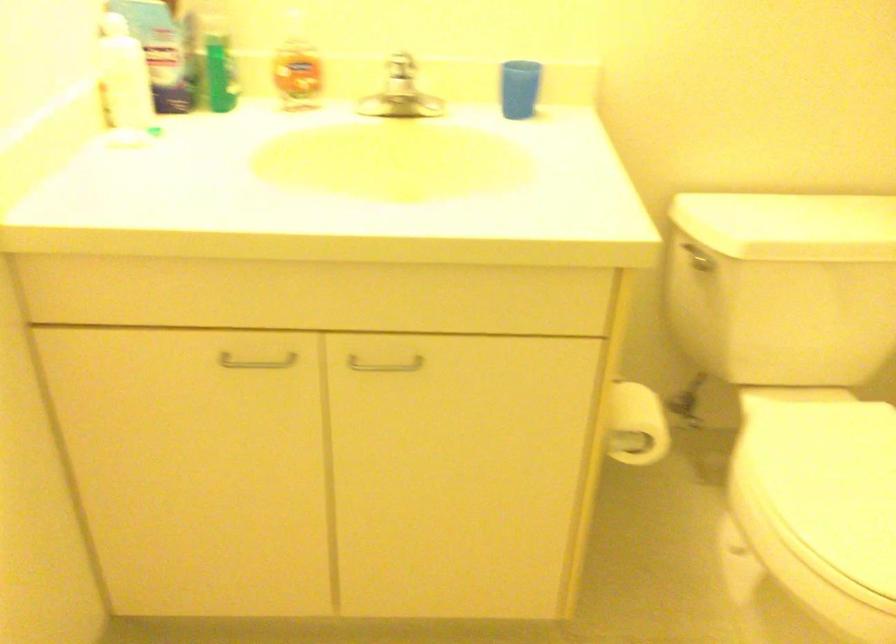
Describe the element at coordinates (698, 257) in the screenshot. Image resolution: width=896 pixels, height=644 pixels. I see `a toilet flush handle` at that location.